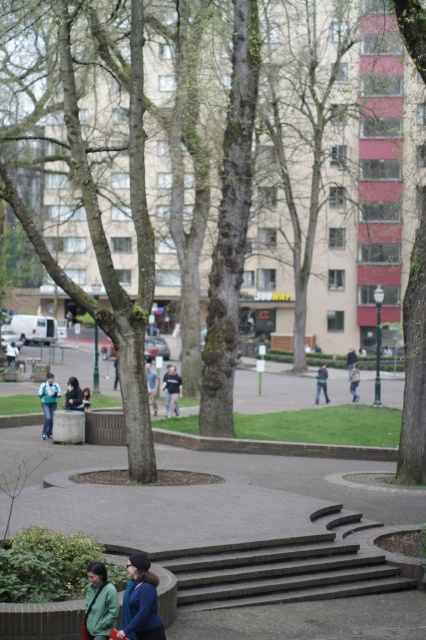
You are a photographer trying to capture a shot of the teal fabric backpack at center and the dark gray shirt at center in the urban park scene. Which object should you focus on first if you want to include both in your frame without zooming in or out?

The teal fabric backpack at center is smaller than the dark gray shirt at center, so you should focus on the teal fabric backpack at center first to ensure it fits properly in the frame before adjusting for the larger dark gray shirt at center.

You are standing at the top of the curved steps in the urban park scene. You see a teal fabric backpack at center and a dark gray shirt at center. Which object is positioned to the left?

The teal fabric backpack at center is to the left of the dark gray shirt at center, so the teal fabric backpack at center is positioned to the left.